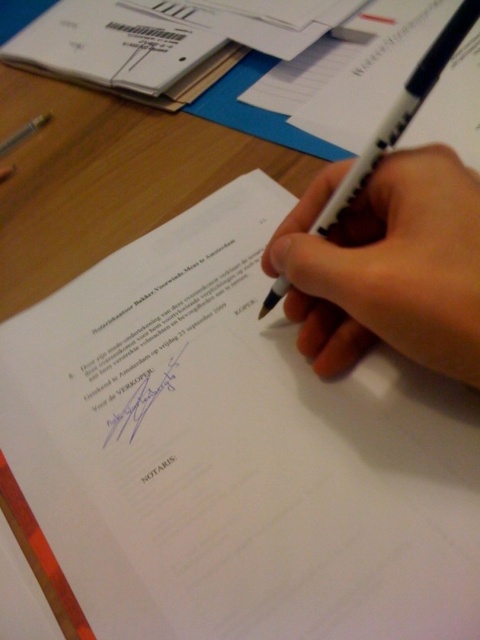
Who is positioned more to the left, white matte pen at center or white plastic pen at center?

white matte pen at center

Is white matte pen at center to the left of white plastic pen at center from the viewer's perspective?

Indeed, white matte pen at center is positioned on the left side of white plastic pen at center.

What do you see at coordinates (387, 266) in the screenshot? The image size is (480, 640). I see `white matte pen at center` at bounding box center [387, 266].

Find the location of `white matte pen at center`. white matte pen at center is located at coordinates (387, 266).